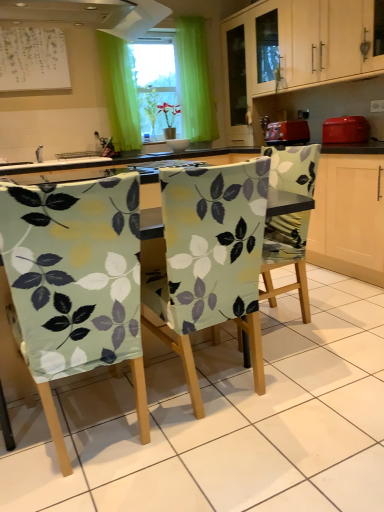
Question: Does light green fabric-covered chair at center, arranged as the 1th chair when viewed from the right, appear on the right side of light wood cabinet at upper center?

Choices:
 (A) no
 (B) yes

Answer: (A)

Question: Considering the relative sizes of light green fabric-covered chair at center, the third chair positioned from the left, and light wood cabinet at upper center in the image provided, is light green fabric-covered chair at center, the third chair positioned from the left, thinner than light wood cabinet at upper center?

Choices:
 (A) no
 (B) yes

Answer: (A)

Question: Could light wood cabinet at upper center be considered to be inside light green fabric-covered chair at center, the third chair positioned from the left?

Choices:
 (A) yes
 (B) no

Answer: (B)

Question: Is light green fabric-covered chair at center, the third chair positioned from the left, in front of light wood cabinet at upper center?

Choices:
 (A) no
 (B) yes

Answer: (B)

Question: Is light green fabric-covered chair at center, the third chair positioned from the left, shorter than light wood cabinet at upper center?

Choices:
 (A) no
 (B) yes

Answer: (A)

Question: Is matte red toaster at right, arranged as the 2th appliance when viewed from the left, wider or thinner than light green fabric-covered chair at center, placed as the 3th chair when sorted from right to left?

Choices:
 (A) wide
 (B) thin

Answer: (B)

Question: Would you say matte red toaster at right, the first appliance when ordered from right to left, is to the left or to the right of light green fabric-covered chair at center, which ranks as the first chair in left-to-right order, in the picture?

Choices:
 (A) right
 (B) left

Answer: (A)

Question: From the image's perspective, relative to light green fabric-covered chair at center, which ranks as the first chair in left-to-right order, is matte red toaster at right, the first appliance when ordered from right to left, above or below?

Choices:
 (A) above
 (B) below

Answer: (A)

Question: Based on their sizes in the image, would you say matte red toaster at right, arranged as the 2th appliance when viewed from the left, is bigger or smaller than light green fabric-covered chair at center, placed as the 3th chair when sorted from right to left?

Choices:
 (A) small
 (B) big

Answer: (A)

Question: Is light wood cabinet at upper center inside or outside of light green fabric-covered chair at center, the 2th chair positioned from the right?

Choices:
 (A) inside
 (B) outside

Answer: (B)

Question: From the image's perspective, is light wood cabinet at upper center above or below light green fabric-covered chair at center, the second chair viewed from the left?

Choices:
 (A) above
 (B) below

Answer: (A)

Question: Considering the positions of light wood cabinet at upper center and light green fabric-covered chair at center, the 2th chair positioned from the right, in the image, is light wood cabinet at upper center bigger or smaller than light green fabric-covered chair at center, the 2th chair positioned from the right,?

Choices:
 (A) small
 (B) big

Answer: (B)

Question: Would you say light wood cabinet at upper center is to the left or to the right of light green fabric-covered chair at center, the second chair viewed from the left, in the picture?

Choices:
 (A) left
 (B) right

Answer: (B)

Question: Is light green fabric-covered chair at center, the second chair viewed from the left, inside the boundaries of white paper at upper left, or outside?

Choices:
 (A) inside
 (B) outside

Answer: (B)

Question: Is point (233, 237) positioned closer to the camera than point (13, 39)?

Choices:
 (A) closer
 (B) farther

Answer: (A)